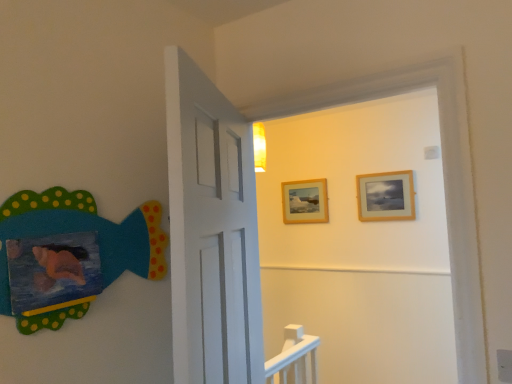
Question: Relative to wooden frame at upper center, the 1th picture frame in the left-to-right sequence, is matte felt fish at left in front or behind?

Choices:
 (A) front
 (B) behind

Answer: (A)

Question: Looking at their shapes, would you say matte felt fish at left is wider or thinner than wooden frame at upper center, the 1th picture frame in the left-to-right sequence?

Choices:
 (A) wide
 (B) thin

Answer: (A)

Question: Estimate the real-world distances between objects in this image. Which object is farther from the wooden frame at upper center, the 2th picture frame viewed from the front?

Choices:
 (A) matte felt fish at left
 (B) wooden frame at upper right, positioned as the 1th picture frame in right-to-left order

Answer: (A)

Question: Which object is the farthest from the wooden frame at upper right, the 2th picture frame when ordered from back to front?

Choices:
 (A) wooden frame at upper center, the 2th picture frame viewed from the front
 (B) matte felt fish at left

Answer: (B)